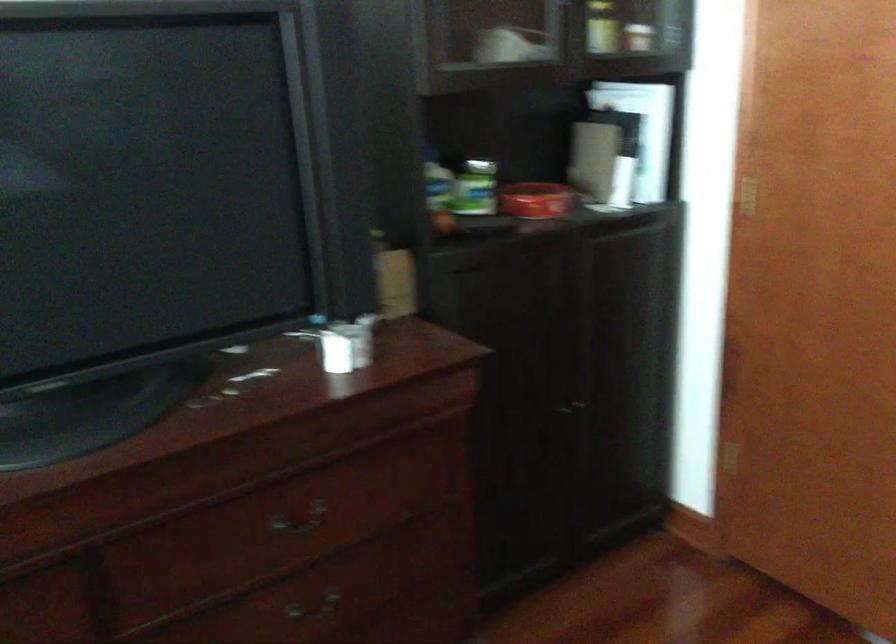
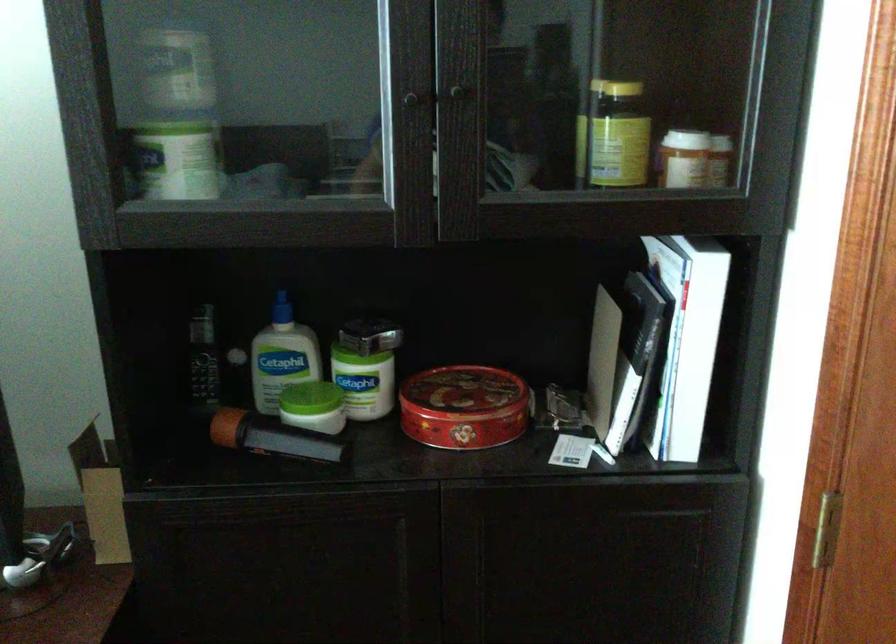
Find the pixel in the second image that matches (x=389, y=189) in the first image.

(202, 357)